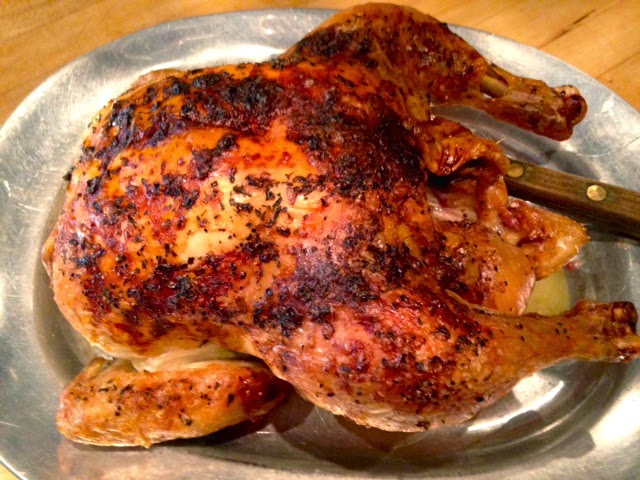
Where is `handle`? handle is located at coordinates (573, 189).